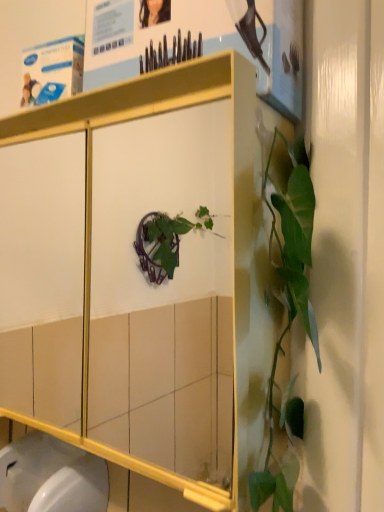
Question: From a real-world perspective, is matte paper poster at upper center physically located above or below white glossy toilet bowl at lower left?

Choices:
 (A) below
 (B) above

Answer: (B)

Question: Looking at their shapes, would you say matte paper poster at upper center is wider or thinner than white glossy toilet bowl at lower left?

Choices:
 (A) wide
 (B) thin

Answer: (B)

Question: Which of these objects is positioned closest to the metallic white cabinet at center?

Choices:
 (A) white glossy toilet bowl at lower left
 (B) matte paper poster at upper center

Answer: (B)

Question: Which of these objects is positioned closest to the metallic white cabinet at center?

Choices:
 (A) white glossy toilet bowl at lower left
 (B) matte paper poster at upper center

Answer: (B)